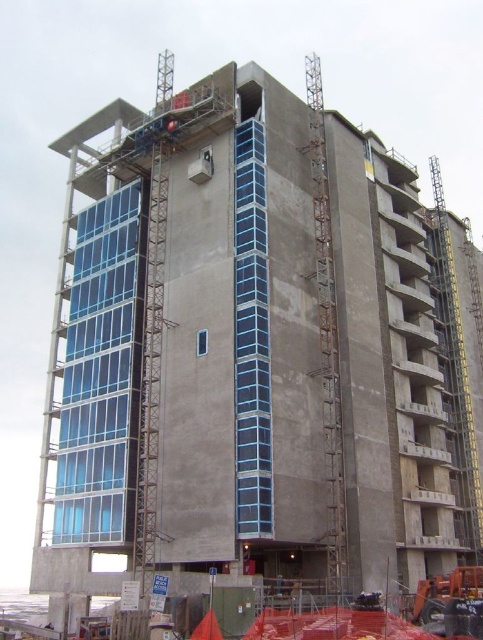
You are a construction worker standing at the base of the building. You need to move a heavy beam from the rusty metal crane at right to the concrete scaffolding at lower center. Given that the beam is 15 meters long, can you safely transport it without bending or breaking it? Please explain your reasoning.

The distance between the rusty metal crane at right and the concrete scaffolding at lower center is 17.85 meters. Since the beam is only 15 meters long, it is shorter than the required distance. Therefore, the beam cannot span the gap safely without bending or breaking. A longer beam or additional support would be needed.